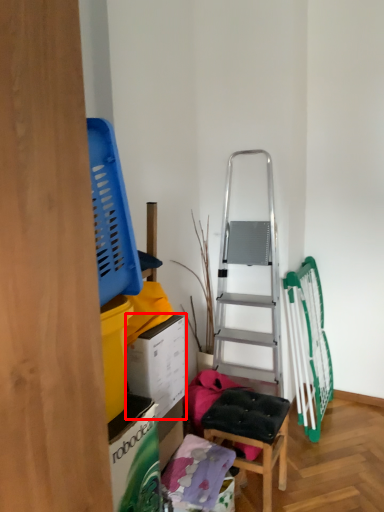
Question: From the image's perspective, where is box (annotated by the red box) located relative to furniture?

Choices:
 (A) below
 (B) above

Answer: (B)